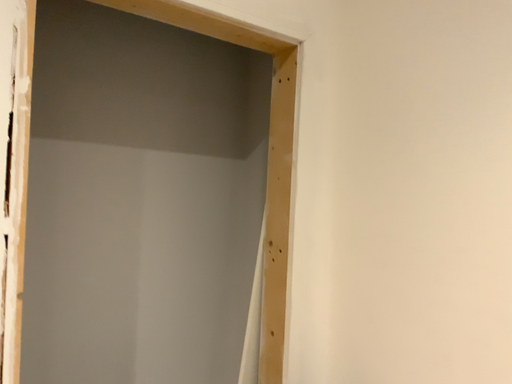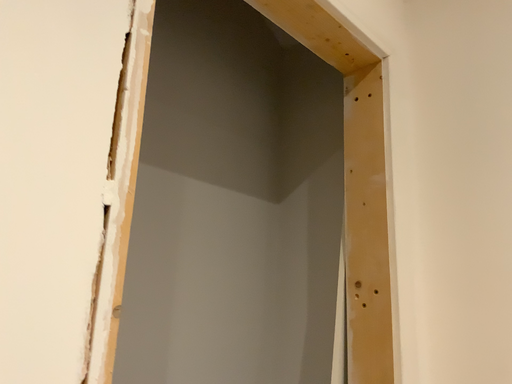
Question: How did the camera likely rotate when shooting the video?

Choices:
 (A) rotated left
 (B) rotated right

Answer: (B)